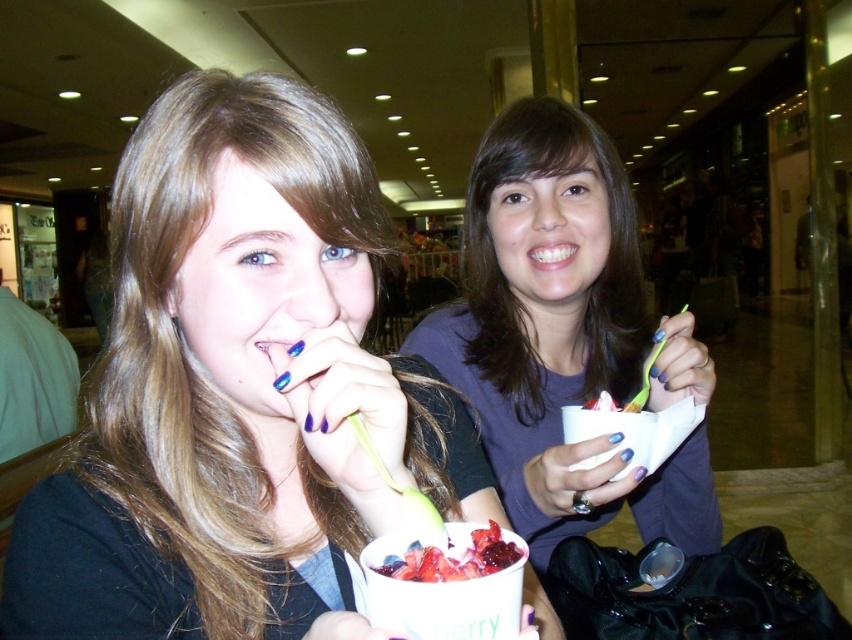
This screenshot has width=852, height=640. Describe the element at coordinates (565, 333) in the screenshot. I see `matte purple shirt at center` at that location.

Can you confirm if matte purple shirt at center is thinner than smooth strawberry dessert at center?

No.

I want to click on matte purple shirt at center, so click(x=565, y=333).

I want to click on matte purple shirt at center, so click(x=565, y=333).

Measure the distance between smooth strawberry dessert at center and blue nail polish at mouth left.

A distance of 5.53 inches exists between smooth strawberry dessert at center and blue nail polish at mouth left.

Is point (491, 534) farther from viewer compared to point (257, 344)?

No.

Does point (418, 561) lie behind point (268, 342)?

No, it is not.

The image size is (852, 640). I want to click on smooth strawberry dessert at center, so click(452, 560).

This screenshot has height=640, width=852. What do you see at coordinates (565, 333) in the screenshot?
I see `matte purple shirt at center` at bounding box center [565, 333].

Looking at this image, between matte purple shirt at center and blue nail polish at mouth left, which one has less height?

blue nail polish at mouth left is shorter.

Is point (507, 490) behind point (296, 349)?

Yes, point (507, 490) is farther from viewer.

I want to click on matte purple shirt at center, so click(565, 333).